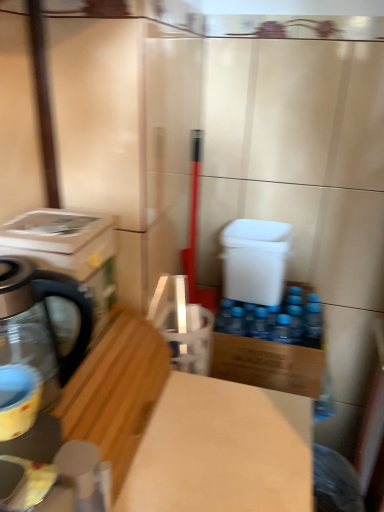
Where is `blank space above white glossy washing machine at left (from a real-world perspective)`? The width and height of the screenshot is (384, 512). blank space above white glossy washing machine at left (from a real-world perspective) is located at coordinates (48, 218).